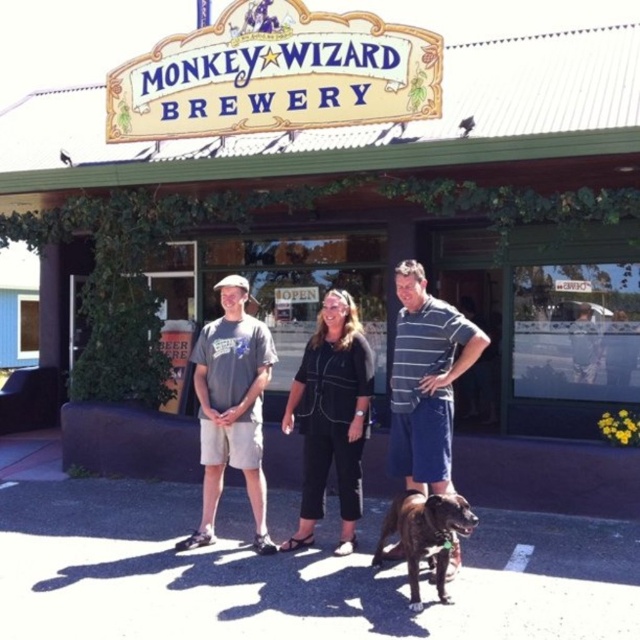
Does striped cotton shirt at center have a smaller size compared to brown brindle dog at center?

No.

Between point (449, 486) and point (460, 509), which one is positioned behind?

Point (449, 486)

In order to click on striped cotton shirt at center in this screenshot , I will do `click(426, 380)`.

Does gray cotton t-shirt at center appear under brown brindle dog at center?

No, gray cotton t-shirt at center is not below brown brindle dog at center.

Measure the distance between point (198, 390) and camera.

5.15 meters

You are a GUI agent. You are given a task and a screenshot of the screen. Output one action in this format:
    pyautogui.click(x=<x>, y=<y>)
    Task: Click on the gray cotton t-shirt at center
    
    Given the screenshot: What is the action you would take?
    pyautogui.click(x=230, y=406)

Locate an element on the screen. The height and width of the screenshot is (640, 640). gray cotton t-shirt at center is located at coordinates (230, 406).

Is dark gray cotton shirt at center shorter than black cotton pants at center?

Indeed, dark gray cotton shirt at center has a lesser height compared to black cotton pants at center.

Is dark gray cotton shirt at center closer to camera compared to black cotton pants at center?

Yes, dark gray cotton shirt at center is in front of black cotton pants at center.

Locate an element on the screen. The image size is (640, 640). dark gray cotton shirt at center is located at coordinates (426, 380).